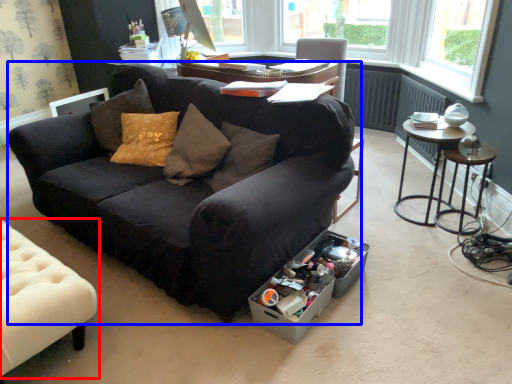
Question: Which object is further to the camera taking this photo, chair (highlighted by a red box) or studio couch (highlighted by a blue box)?

Choices:
 (A) chair
 (B) studio couch

Answer: (A)